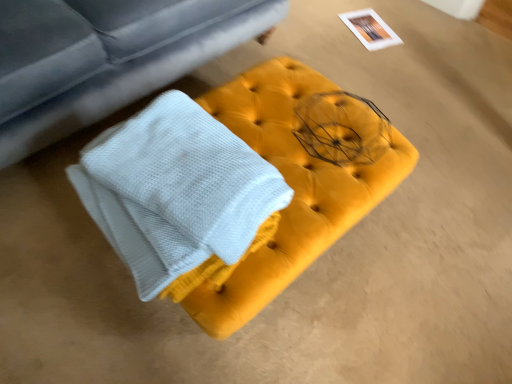
What do you see at coordinates (292, 187) in the screenshot?
I see `velvet yellow ottoman at center` at bounding box center [292, 187].

In order to face velvet yellow ottoman at center, should I rotate leftwards or rightwards?

You should rotate right by 0.355 degrees.

Identify the location of velvet yellow ottoman at center. Image resolution: width=512 pixels, height=384 pixels. (292, 187).

What do you see at coordinates (106, 57) in the screenshot?
I see `matte gray studio couch at upper left` at bounding box center [106, 57].

What are the coordinates of `matte gray studio couch at upper left` in the screenshot? It's located at (106, 57).

I want to click on velvet yellow ottoman at center, so click(x=292, y=187).

Considering the positions of objects velvet yellow ottoman at center and matte gray studio couch at upper left in the image provided, who is more to the left, velvet yellow ottoman at center or matte gray studio couch at upper left?

From the viewer's perspective, matte gray studio couch at upper left appears more on the left side.

Between velvet yellow ottoman at center and matte gray studio couch at upper left, which one is positioned in front?

matte gray studio couch at upper left is in front.

Does point (209, 323) appear closer or farther from the camera than point (53, 49)?

Clearly, point (209, 323) is closer to the camera than point (53, 49).

From the image's perspective, is velvet yellow ottoman at center under matte gray studio couch at upper left?

Indeed, from the image's perspective, velvet yellow ottoman at center is shown beneath matte gray studio couch at upper left.

From a real-world perspective, is velvet yellow ottoman at center located beneath matte gray studio couch at upper left?

Yes, from a real-world perspective, velvet yellow ottoman at center is beneath matte gray studio couch at upper left.

Which of these two, velvet yellow ottoman at center or matte gray studio couch at upper left, is wider?

matte gray studio couch at upper left is wider.

Is velvet yellow ottoman at center taller or shorter than matte gray studio couch at upper left?

velvet yellow ottoman at center is shorter than matte gray studio couch at upper left.

Considering the sizes of objects velvet yellow ottoman at center and matte gray studio couch at upper left in the image provided, who is smaller, velvet yellow ottoman at center or matte gray studio couch at upper left?

velvet yellow ottoman at center is smaller.

Is velvet yellow ottoman at center situated inside matte gray studio couch at upper left or outside?

velvet yellow ottoman at center is not enclosed by matte gray studio couch at upper left.

Are velvet yellow ottoman at center and matte gray studio couch at upper left far apart?

No.

Consider the image. Is velvet yellow ottoman at center oriented towards matte gray studio couch at upper left?

No, velvet yellow ottoman at center is not aimed at matte gray studio couch at upper left.

In the scene shown: What's the angular difference between velvet yellow ottoman at center and matte gray studio couch at upper left's facing directions?

velvet yellow ottoman at center and matte gray studio couch at upper left are facing 88 degrees away from each other.

The height and width of the screenshot is (384, 512). What are the coordinates of `studio couch on the left of velvet yellow ottoman at center` in the screenshot? It's located at (106, 57).

Can you confirm if matte gray studio couch at upper left is positioned to the right of velvet yellow ottoman at center?

Incorrect, matte gray studio couch at upper left is not on the right side of velvet yellow ottoman at center.

Which object is further away from the camera, matte gray studio couch at upper left or velvet yellow ottoman at center?

velvet yellow ottoman at center.

Considering the points (122, 59) and (317, 219), which point is in front, point (122, 59) or point (317, 219)?

The point (317, 219) is more forward.

From the image's perspective, which object appears higher, matte gray studio couch at upper left or velvet yellow ottoman at center?

matte gray studio couch at upper left, from the image's perspective.

From a real-world perspective, who is located lower, matte gray studio couch at upper left or velvet yellow ottoman at center?

velvet yellow ottoman at center is physically lower.

Is matte gray studio couch at upper left wider or thinner than velvet yellow ottoman at center?

matte gray studio couch at upper left is wider than velvet yellow ottoman at center.

Is matte gray studio couch at upper left taller than velvet yellow ottoman at center?

Indeed, matte gray studio couch at upper left has a greater height compared to velvet yellow ottoman at center.

Considering the sizes of objects matte gray studio couch at upper left and velvet yellow ottoman at center in the image provided, who is smaller, matte gray studio couch at upper left or velvet yellow ottoman at center?

Smaller between the two is velvet yellow ottoman at center.

Looking at this image, does matte gray studio couch at upper left contain velvet yellow ottoman at center?

Actually, velvet yellow ottoman at center is outside matte gray studio couch at upper left.

Is matte gray studio couch at upper left directly adjacent to velvet yellow ottoman at center?

No, matte gray studio couch at upper left is not beside velvet yellow ottoman at center.

Could you tell me if matte gray studio couch at upper left is turned towards velvet yellow ottoman at center?

Yes, matte gray studio couch at upper left is aimed at velvet yellow ottoman at center.

How many degrees apart are the facing directions of matte gray studio couch at upper left and velvet yellow ottoman at center?

88 degrees.

From the picture: How distant is matte gray studio couch at upper left from velvet yellow ottoman at center?

matte gray studio couch at upper left is 22.22 inches away from velvet yellow ottoman at center.

Image resolution: width=512 pixels, height=384 pixels. I want to click on studio couch lying on the left of velvet yellow ottoman at center, so click(x=106, y=57).

This screenshot has height=384, width=512. In the image, there is a velvet yellow ottoman at center. Find the location of `studio couch above it (from the image's perspective)`. studio couch above it (from the image's perspective) is located at coordinates (106, 57).

What are the coordinates of `furniture below the matte gray studio couch at upper left (from the image's perspective)` in the screenshot? It's located at (292, 187).